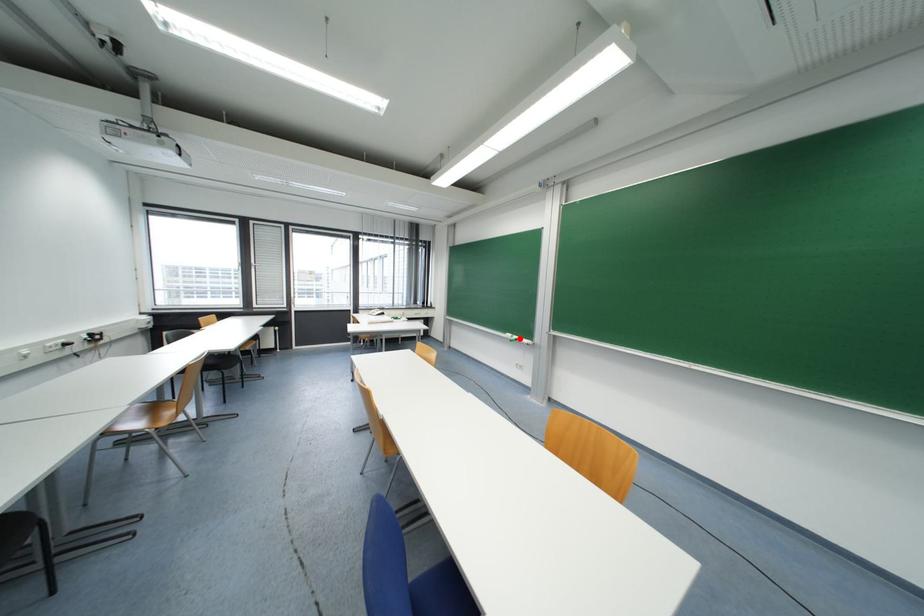
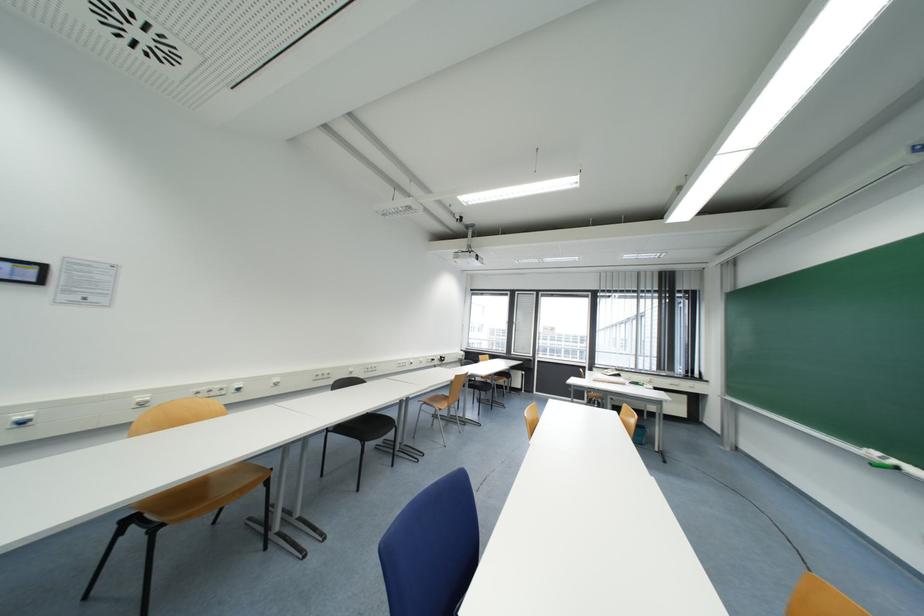
Question: A red point is marked in image1. In image2, is the corresponding 3D point closer to the camera or farther? Reply with the corresponding letter.

Choices:
 (A) The corresponding 3D point is closer.
 (B) The corresponding 3D point is farther.

Answer: (A)